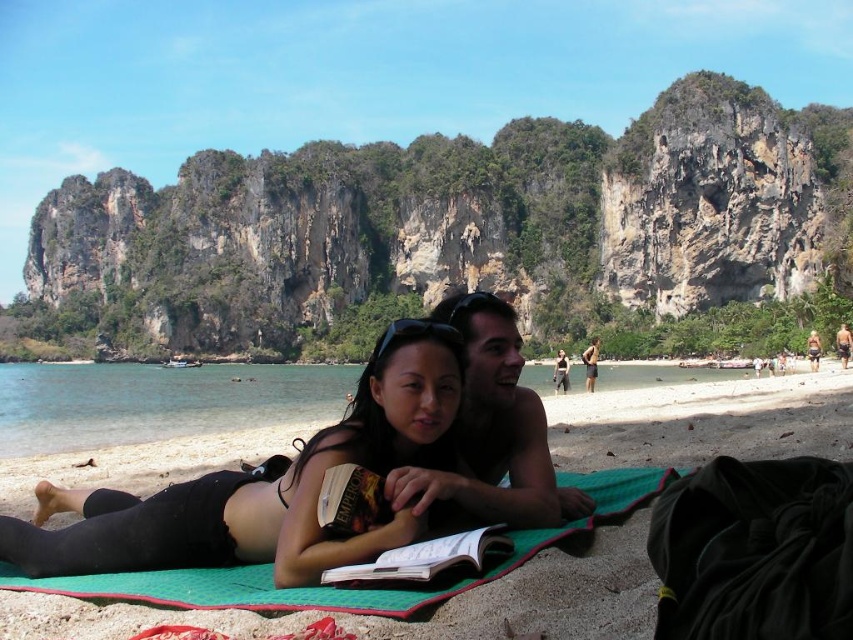
You are a photographer trying to capture the black matte bikini top at center in your shot. There is a point marked at coordinate [268,486]. Based on the scene description, where exactly is this point located on the black matte bikini top at center?

The point at coordinate [268,486] is located on the black matte bikini top at center.